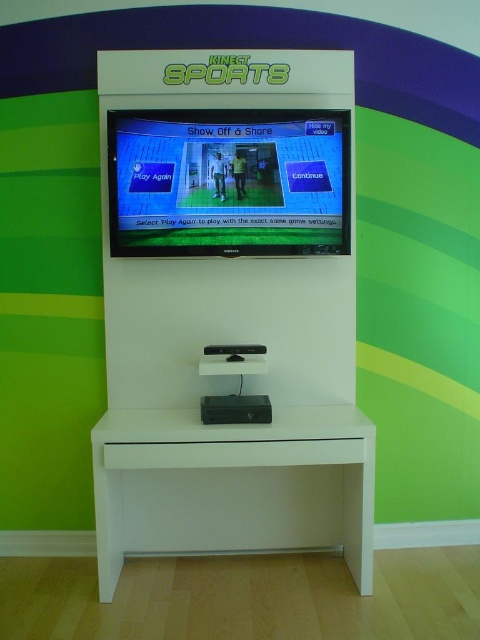
You are setting up a new Xbox Kinect Sports game and need to place a controller on the closest object to you. Which object should you choose between the white glossy entertainment center at center and the white matte table at center?

The white glossy entertainment center at center is closer to you, so you should place the controller there.

You are setting up a new Xbox Kinect Sports game and need to place the console stand exactly at the center of the room. The room has a coordinate system where the bottom left corner is at point 0,0 and the top right corner is at point 1,1. According to the image, where should you place the white glossy entertainment center at center to match the setup?

The white glossy entertainment center at center should be placed at point (229, 308) to match the setup.

In the scene shown: You are standing in front of the Xbox Kinect Sports setup. There is a point marked at coordinates point (212,470). Can you reach that point without moving your feet?

The distance between you and point (212,470) is 8.86 feet. Since this distance is greater than the typical human arm length, you cannot reach the point without moving your feet.